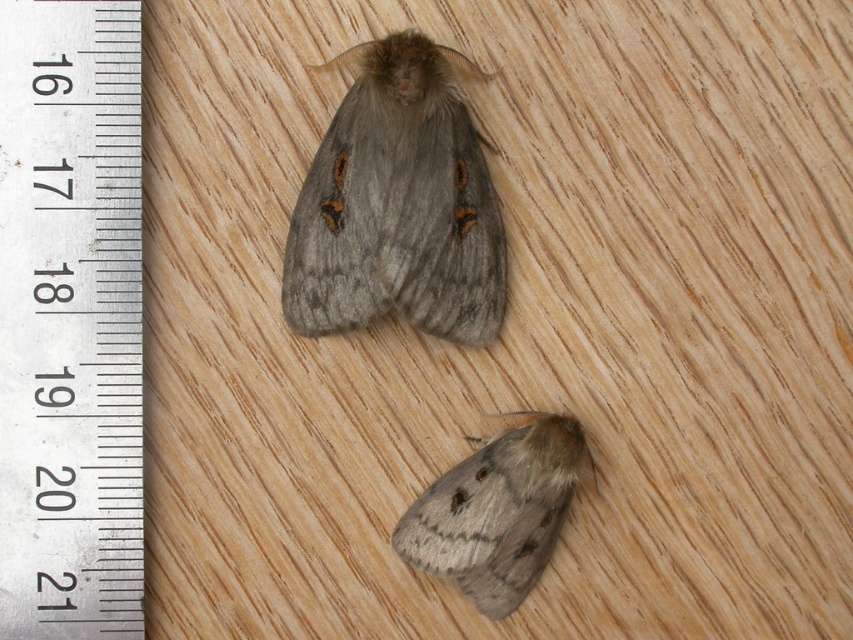
You are an entomologist examining two fuzzy gray moths on a wooden surface. You need to determine which one is larger. Based on their positions in the image, can you identify which of the fuzzy gray moth at upper center or the fuzzy gray moth at lower center is bigger?

The fuzzy gray moth at upper center is bigger than the fuzzy gray moth at lower center according to the ruler scale in the image.